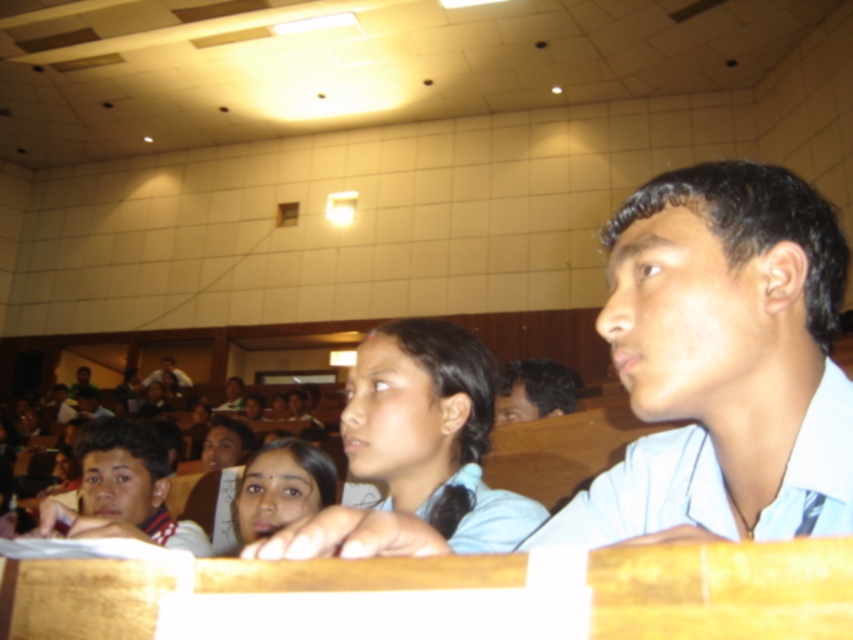
You are a student sitting at the light brown wooden desk at center in the classroom. You want to look at the dark brown hair at center. Where should you look relative to your desk?

The dark brown hair at center is above the light brown wooden desk at center, so you should look upward to see it.

You are a student in the classroom and you want to locate the person with dark brown hair at center. What are the coordinates of their position?

The coordinates of the dark brown hair at center are at point (532, 390).

You are a student in the classroom. You notice the matte white shirt at left and the dark brown hair at center. Which object is closer to you?

The matte white shirt at left is closer to you because it is in front of the dark brown hair at center.